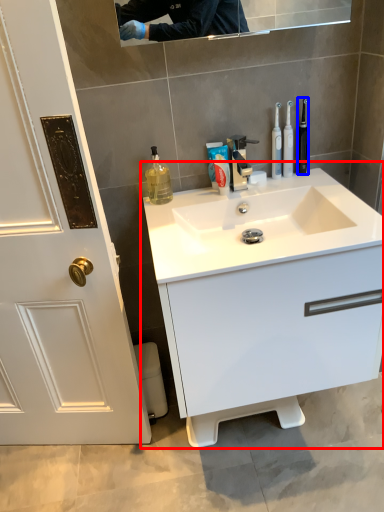
Question: Which object is further to the camera taking this photo, bathroom cabinet (highlighted by a red box) or toothbrush (highlighted by a blue box)?

Choices:
 (A) bathroom cabinet
 (B) toothbrush

Answer: (B)